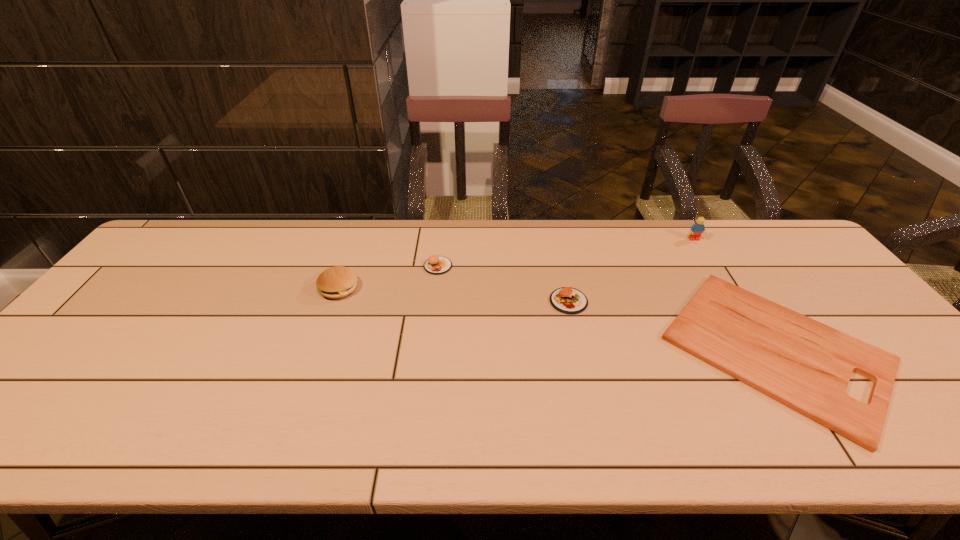
The image size is (960, 540). Find the location of `vacant point located between the fourth tallest object and the leftmost object`. vacant point located between the fourth tallest object and the leftmost object is located at coordinates (454, 295).

At what (x,y) coordinates should I click in order to perform the action: click on free space that is in between the tallest object and the second object from left to right. Please return your answer as a coordinate pair (x, y). This screenshot has height=540, width=960. Looking at the image, I should click on (566, 253).

Identify the location of free space that is in between the tallest patty (food) and the rightmost patty (food). (454, 295).

This screenshot has height=540, width=960. In order to click on free space between the fourth tallest object and the farthest patty (food) in this screenshot , I will do `click(503, 284)`.

Find the location of a particular element. The height and width of the screenshot is (540, 960). object that stands as the second closest to the shortest object is located at coordinates (697, 229).

In order to click on object that is the fourth nearest to the tallest object in this screenshot , I will do (337, 282).

Identify which patty (food) is the second nearest to the farthest patty (food). Please provide its 2D coordinates. Your answer should be formatted as a tuple, i.e. [(x, y)], where the tuple contains the x and y coordinates of a point satisfying the conditions above.

[(568, 300)]

Identify which patty (food) is the second closest to the leftmost patty (food). Please provide its 2D coordinates. Your answer should be formatted as a tuple, i.e. [(x, y)], where the tuple contains the x and y coordinates of a point satisfying the conditions above.

[(568, 300)]

You are a GUI agent. You are given a task and a screenshot of the screen. Output one action in this format:
    pyautogui.click(x=<x>, y=<y>)
    Task: Click on the free location that satisfies the following two spatial constraints: 1. on the front side of the rightmost patty (food); 2. on the left side of the fourth nearest object
    
    Given the screenshot: What is the action you would take?
    pyautogui.click(x=434, y=301)